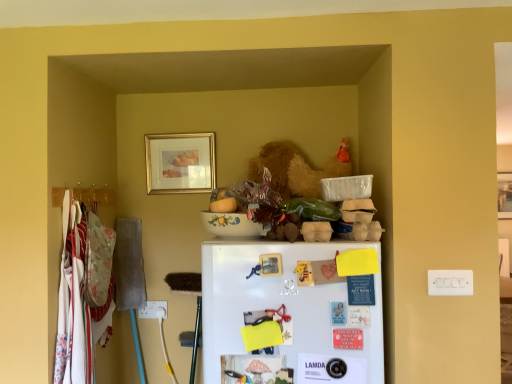
This screenshot has width=512, height=384. Describe the element at coordinates (180, 163) in the screenshot. I see `gold-framed picture at upper center, arranged as the 2th picture frame when viewed from the back` at that location.

Where is `wooden picture frame at upper right, positioned as the second picture frame in left-to-right order`? wooden picture frame at upper right, positioned as the second picture frame in left-to-right order is located at coordinates (504, 195).

The width and height of the screenshot is (512, 384). Find the location of `gold-framed picture at upper center, arranged as the 2th picture frame when viewed from the back`. gold-framed picture at upper center, arranged as the 2th picture frame when viewed from the back is located at coordinates (180, 163).

Is white matte refrigerator at center positioned before wooden picture frame at upper right, the 1th picture frame from the right?

Yes, it is in front of wooden picture frame at upper right, the 1th picture frame from the right.

Is point (286, 341) closer or farther from the camera than point (508, 183)?

Point (286, 341) is positioned closer to the camera compared to point (508, 183).

In order to click on the 1st picture frame positioned above the white matte refrigerator at center (from the image's perspective) in this screenshot , I will do `click(504, 195)`.

From the image's perspective, which one is positioned lower, white matte refrigerator at center or wooden picture frame at upper right, positioned as the second picture frame in left-to-right order?

white matte refrigerator at center appears lower in the image.

Is the position of gold-framed picture at upper center, which appears as the 1th picture frame when viewed from the front, less distant than that of wooden picture frame at upper right, which is counted as the 2th picture frame, starting from the front?

That is True.

Would you say gold-framed picture at upper center, which is counted as the 2th picture frame, starting from the right, is to the left or to the right of wooden picture frame at upper right, the 1th picture frame from the right, in the picture?

From the image, it's evident that gold-framed picture at upper center, which is counted as the 2th picture frame, starting from the right, is to the left of wooden picture frame at upper right, the 1th picture frame from the right.

Which of these two, gold-framed picture at upper center, which is the 1th picture frame from left to right, or wooden picture frame at upper right, the 1th picture frame from the right, stands shorter?

gold-framed picture at upper center, which is the 1th picture frame from left to right, is shorter.

From a real-world perspective, is gold-framed picture at upper center, arranged as the 2th picture frame when viewed from the back, located beneath wooden picture frame at upper right, which is counted as the 2th picture frame, starting from the front?

Actually, gold-framed picture at upper center, arranged as the 2th picture frame when viewed from the back, is physically above wooden picture frame at upper right, which is counted as the 2th picture frame, starting from the front, in the real world.

Considering the points (498, 214) and (186, 150), which point is in front, point (498, 214) or point (186, 150)?

Positioned in front is point (186, 150).

Based on the photo, from a real-world perspective, which object rests below the other?

From a 3D spatial view, wooden picture frame at upper right, the 1th picture frame from the right, is below.

From the image's perspective, is wooden picture frame at upper right, the 1th picture frame in the back-to-front sequence, positioned above or below gold-framed picture at upper center, which is the 1th picture frame from left to right?

From the image's perspective, wooden picture frame at upper right, the 1th picture frame in the back-to-front sequence, appears below gold-framed picture at upper center, which is the 1th picture frame from left to right.

Identify the location of picture frame below the gold-framed picture at upper center, which appears as the 1th picture frame when viewed from the front (from the image's perspective). (504, 195).

What's the angular difference between white matte refrigerator at center and gold-framed picture at upper center, arranged as the 2th picture frame when viewed from the back,'s facing directions?

There is a 1.82-degree angle between the facing directions of white matte refrigerator at center and gold-framed picture at upper center, arranged as the 2th picture frame when viewed from the back.

Is white matte refrigerator at center positioned with its back to gold-framed picture at upper center, arranged as the 2th picture frame when viewed from the back?

No, white matte refrigerator at center is not facing the opposite direction of gold-framed picture at upper center, arranged as the 2th picture frame when viewed from the back.

Between white matte refrigerator at center and gold-framed picture at upper center, which is counted as the 2th picture frame, starting from the right, which one is positioned behind?

gold-framed picture at upper center, which is counted as the 2th picture frame, starting from the right, is behind.

Which of these two, white matte refrigerator at center or gold-framed picture at upper center, arranged as the 2th picture frame when viewed from the back, is thinner?

With smaller width is gold-framed picture at upper center, arranged as the 2th picture frame when viewed from the back.

Image resolution: width=512 pixels, height=384 pixels. Find the location of `refrigerator below the gold-framed picture at upper center, arranged as the 2th picture frame when viewed from the back (from the image's perspective)`. refrigerator below the gold-framed picture at upper center, arranged as the 2th picture frame when viewed from the back (from the image's perspective) is located at coordinates (291, 312).

Between gold-framed picture at upper center, which appears as the 1th picture frame when viewed from the front, and white matte refrigerator at center, which one has smaller size?

gold-framed picture at upper center, which appears as the 1th picture frame when viewed from the front.

Is gold-framed picture at upper center, which is the 1th picture frame from left to right, facing away from white matte refrigerator at center?

No, gold-framed picture at upper center, which is the 1th picture frame from left to right, is not facing away from white matte refrigerator at center.

In the scene shown: From the image's perspective, is gold-framed picture at upper center, which appears as the 1th picture frame when viewed from the front, above or below white matte refrigerator at center?

gold-framed picture at upper center, which appears as the 1th picture frame when viewed from the front, is situated higher than white matte refrigerator at center in the image.

Is wooden picture frame at upper right, the 1th picture frame in the back-to-front sequence, further to the viewer compared to white matte refrigerator at center?

Yes, the depth of wooden picture frame at upper right, the 1th picture frame in the back-to-front sequence, is greater than that of white matte refrigerator at center.

Based on the photo, does wooden picture frame at upper right, which is counted as the 2th picture frame, starting from the front, have a smaller size compared to white matte refrigerator at center?

Yes, wooden picture frame at upper right, which is counted as the 2th picture frame, starting from the front, is smaller than white matte refrigerator at center.

Can you tell me how much wooden picture frame at upper right, the 1th picture frame in the back-to-front sequence, and white matte refrigerator at center differ in facing direction?

The angular difference between wooden picture frame at upper right, the 1th picture frame in the back-to-front sequence, and white matte refrigerator at center is 0.0132 degrees.

Measure the distance from wooden picture frame at upper right, which is counted as the 2th picture frame, starting from the front, to white matte refrigerator at center.

The distance of wooden picture frame at upper right, which is counted as the 2th picture frame, starting from the front, from white matte refrigerator at center is 5.17 feet.

The height and width of the screenshot is (384, 512). Find the location of `refrigerator below the wooden picture frame at upper right, positioned as the second picture frame in left-to-right order (from a real-world perspective)`. refrigerator below the wooden picture frame at upper right, positioned as the second picture frame in left-to-right order (from a real-world perspective) is located at coordinates (291, 312).

Find the location of a particular element. This screenshot has height=384, width=512. picture frame on the left of the wooden picture frame at upper right, the 1th picture frame from the right is located at coordinates (180, 163).

Based on their spatial positions, is wooden picture frame at upper right, the 1th picture frame from the right, or white matte refrigerator at center closer to gold-framed picture at upper center, which appears as the 1th picture frame when viewed from the front?

white matte refrigerator at center.

From the image, which object appears to be nearer to wooden picture frame at upper right, the 1th picture frame from the right, gold-framed picture at upper center, arranged as the 2th picture frame when viewed from the back, or white matte refrigerator at center?

Among the two, white matte refrigerator at center is located nearer to wooden picture frame at upper right, the 1th picture frame from the right.

When comparing their distances from white matte refrigerator at center, does wooden picture frame at upper right, positioned as the second picture frame in left-to-right order, or gold-framed picture at upper center, which is the 1th picture frame from left to right, seem further?

The object further to white matte refrigerator at center is wooden picture frame at upper right, positioned as the second picture frame in left-to-right order.

Looking at the image, which one is located closer to gold-framed picture at upper center, which is counted as the 2th picture frame, starting from the right, white matte refrigerator at center or wooden picture frame at upper right, positioned as the second picture frame in left-to-right order?

white matte refrigerator at center lies closer to gold-framed picture at upper center, which is counted as the 2th picture frame, starting from the right, than the other object.

From the image, which object appears to be farther from wooden picture frame at upper right, the 1th picture frame in the back-to-front sequence, white matte refrigerator at center or gold-framed picture at upper center, which is counted as the 2th picture frame, starting from the right?

Among the two, gold-framed picture at upper center, which is counted as the 2th picture frame, starting from the right, is located further to wooden picture frame at upper right, the 1th picture frame in the back-to-front sequence.

Looking at the image, which one is located further to white matte refrigerator at center, gold-framed picture at upper center, which is the 1th picture frame from left to right, or wooden picture frame at upper right, the 1th picture frame from the right?

wooden picture frame at upper right, the 1th picture frame from the right, is further to white matte refrigerator at center.

Image resolution: width=512 pixels, height=384 pixels. In order to click on picture frame between white matte refrigerator at center and wooden picture frame at upper right, the 1th picture frame in the back-to-front sequence, in the front-back direction in this screenshot , I will do `click(180, 163)`.